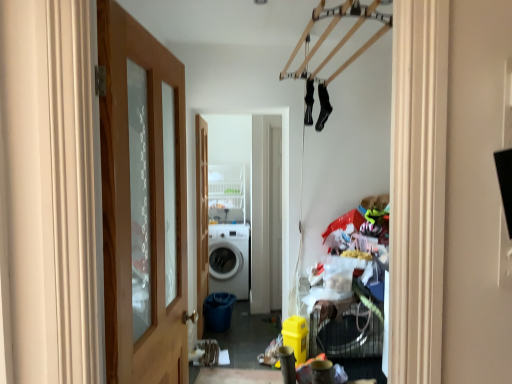
In the scene shown: How much space does black fabric socks at upper center, which ranks as the 1th clothing in right-to-left order, occupy vertically?

black fabric socks at upper center, which ranks as the 1th clothing in right-to-left order, is 14.52 inches in height.

This screenshot has width=512, height=384. Identify the location of black fabric socks at upper center, which ranks as the 1th clothing in right-to-left order. (323, 107).

The height and width of the screenshot is (384, 512). I want to click on white matte washing machine at center, so click(229, 259).

There is a wooden door at center, acting as the first door starting from the back. Where is `the 2nd clothing above it (from a real-world perspective)`? The width and height of the screenshot is (512, 384). the 2nd clothing above it (from a real-world perspective) is located at coordinates (309, 102).

Between black fabric socks at upper center, the second clothing positioned from the right, and wooden door at center, the second door in the right-to-left sequence, which one is positioned in front?

black fabric socks at upper center, the second clothing positioned from the right, is more forward.

Does black fabric socks at upper center, marked as the first clothing in a left-to-right arrangement, have a greater width compared to wooden door at center, which is the second door in front-to-back order?

In fact, black fabric socks at upper center, marked as the first clothing in a left-to-right arrangement, might be narrower than wooden door at center, which is the second door in front-to-back order.

Is point (307, 111) closer to camera compared to point (206, 154)?

Yes, it is.

Is point (176, 361) in front of point (197, 269)?

That is True.

Which is correct: wooden door at left, acting as the second door starting from the left, is inside wooden door at center, which is the second door in front-to-back order, or outside of it?

wooden door at left, acting as the second door starting from the left, lies outside wooden door at center, which is the second door in front-to-back order.

Which object is wider, wooden door at left, acting as the second door starting from the left, or wooden door at center, the second door in the right-to-left sequence?

wooden door at left, acting as the second door starting from the left.

Looking at this image, does wooden door at left, acting as the second door starting from the left, turn towards wooden door at center, the second door in the right-to-left sequence?

No, wooden door at left, acting as the second door starting from the left, is not aimed at wooden door at center, the second door in the right-to-left sequence.

Does point (323, 94) appear closer or farther from the camera than point (305, 96)?

Point (323, 94) is closer to the camera than point (305, 96).

Considering the relative sizes of black fabric socks at upper center, which ranks as the 1th clothing in right-to-left order, and black fabric socks at upper center, the second clothing positioned from the right, in the image provided, is black fabric socks at upper center, which ranks as the 1th clothing in right-to-left order, bigger than black fabric socks at upper center, the second clothing positioned from the right,?

Yes, black fabric socks at upper center, which ranks as the 1th clothing in right-to-left order, is bigger than black fabric socks at upper center, the second clothing positioned from the right.

Considering the relative sizes of black fabric socks at upper center, which is counted as the 2th clothing, starting from the left, and black fabric socks at upper center, marked as the first clothing in a left-to-right arrangement, in the image provided, is black fabric socks at upper center, which is counted as the 2th clothing, starting from the left, shorter than black fabric socks at upper center, marked as the first clothing in a left-to-right arrangement,?

Incorrect, the height of black fabric socks at upper center, which is counted as the 2th clothing, starting from the left, does not fall short of that of black fabric socks at upper center, marked as the first clothing in a left-to-right arrangement.

From a real-world perspective, is black fabric socks at upper center, which is counted as the 2th clothing, starting from the left, over black fabric socks at upper center, the second clothing positioned from the right?

No, from a real-world perspective, black fabric socks at upper center, which is counted as the 2th clothing, starting from the left, is not on top of black fabric socks at upper center, the second clothing positioned from the right.

Considering their positions, is wooden door at center, acting as the first door starting from the back, located in front of or behind black fabric socks at upper center, which is counted as the 2th clothing, starting from the left?

In the image, wooden door at center, acting as the first door starting from the back, appears behind black fabric socks at upper center, which is counted as the 2th clothing, starting from the left.

Between wooden door at center, acting as the first door starting from the back, and black fabric socks at upper center, which is counted as the 2th clothing, starting from the left, which one has smaller size?

black fabric socks at upper center, which is counted as the 2th clothing, starting from the left, is smaller.

Where is `door behind the black fabric socks at upper center, which ranks as the 1th clothing in right-to-left order`? Image resolution: width=512 pixels, height=384 pixels. door behind the black fabric socks at upper center, which ranks as the 1th clothing in right-to-left order is located at coordinates (202, 218).

Is wooden door at center, which is the second door in front-to-back order, turned away from black fabric socks at upper center, which is counted as the 2th clothing, starting from the left?

wooden door at center, which is the second door in front-to-back order, is not turned away from black fabric socks at upper center, which is counted as the 2th clothing, starting from the left.

Which of these two, black fabric socks at upper center, which is counted as the 2th clothing, starting from the left, or wooden door at center, which is the second door in front-to-back order, stands taller?

Standing taller between the two is wooden door at center, which is the second door in front-to-back order.

Choose the correct answer: Is black fabric socks at upper center, which is counted as the 2th clothing, starting from the left, inside wooden door at center, the second door in the right-to-left sequence, or outside it?

black fabric socks at upper center, which is counted as the 2th clothing, starting from the left, exists outside the volume of wooden door at center, the second door in the right-to-left sequence.

In the scene shown: Which object is positioned more to the left, black fabric socks at upper center, which is counted as the 2th clothing, starting from the left, or wooden door at center, acting as the first door starting from the back?

Positioned to the left is wooden door at center, acting as the first door starting from the back.

Considering the relative sizes of white matte washing machine at center and wooden door at left, which appears as the first door when viewed from the front, in the image provided, is white matte washing machine at center thinner than wooden door at left, which appears as the first door when viewed from the front,?

No.

From the image's perspective, is white matte washing machine at center located above or below wooden door at left, which is the 2th door from back to front?

white matte washing machine at center is below wooden door at left, which is the 2th door from back to front.

Is white matte washing machine at center in contact with wooden door at left, the first door when ordered from right to left?

No, white matte washing machine at center is not making contact with wooden door at left, the first door when ordered from right to left.

Is point (228, 270) positioned before point (104, 106)?

No.

Is point (197, 269) positioned after point (241, 245)?

No, (197, 269) is closer to viewer.

Looking at this image, can you confirm if wooden door at center, which is the second door in front-to-back order, is taller than white matte washing machine at center?

Indeed, wooden door at center, which is the second door in front-to-back order, has a greater height compared to white matte washing machine at center.

Is wooden door at center, which is the second door in front-to-back order, facing towards white matte washing machine at center?

No, wooden door at center, which is the second door in front-to-back order, is not aimed at white matte washing machine at center.

Would you say wooden door at center, arranged as the 1th door when viewed from the left, is to the left or to the right of white matte washing machine at center in the picture?

Clearly, wooden door at center, arranged as the 1th door when viewed from the left, is on the left of white matte washing machine at center in the image.

In order to click on the 2nd clothing in front of the wooden door at center, acting as the first door starting from the back, counting from the anchor's position in this screenshot , I will do `click(309, 102)`.

This screenshot has height=384, width=512. What are the coordinates of `door that is below the wooden door at left, the first door when ordered from right to left (from the image's perspective)` in the screenshot? It's located at (202, 218).

From the image, which object appears to be nearer to black fabric socks at upper center, which ranks as the 1th clothing in right-to-left order, black fabric socks at upper center, marked as the first clothing in a left-to-right arrangement, or white matte washing machine at center?

Based on the image, black fabric socks at upper center, marked as the first clothing in a left-to-right arrangement, appears to be nearer to black fabric socks at upper center, which ranks as the 1th clothing in right-to-left order.

From the picture: From the image, which object appears to be farther from black fabric socks at upper center, which is counted as the 2th clothing, starting from the left, white matte washing machine at center or black fabric socks at upper center, marked as the first clothing in a left-to-right arrangement?

white matte washing machine at center is further to black fabric socks at upper center, which is counted as the 2th clothing, starting from the left.

From the image, which object appears to be nearer to wooden door at center, acting as the first door starting from the back, white matte washing machine at center or wooden door at left, which is the 2th door from back to front?

The object closer to wooden door at center, acting as the first door starting from the back, is white matte washing machine at center.

When comparing their distances from black fabric socks at upper center, marked as the first clothing in a left-to-right arrangement, does wooden door at left, the first door when ordered from right to left, or white matte washing machine at center seem closer?

wooden door at left, the first door when ordered from right to left, lies closer to black fabric socks at upper center, marked as the first clothing in a left-to-right arrangement, than the other object.

Which object lies further to the anchor point black fabric socks at upper center, which is counted as the 2th clothing, starting from the left, white matte washing machine at center or wooden door at left, which is the 2th door from back to front?

Among the two, white matte washing machine at center is located further to black fabric socks at upper center, which is counted as the 2th clothing, starting from the left.

Which object lies nearer to the anchor point white matte washing machine at center, wooden door at center, the second door in the right-to-left sequence, or wooden door at left, acting as the second door starting from the left?

Based on the image, wooden door at center, the second door in the right-to-left sequence, appears to be nearer to white matte washing machine at center.

Estimate the real-world distances between objects in this image. Which object is closer to black fabric socks at upper center, which ranks as the 1th clothing in right-to-left order, wooden door at left, which appears as the first door when viewed from the front, or black fabric socks at upper center, marked as the first clothing in a left-to-right arrangement?

black fabric socks at upper center, marked as the first clothing in a left-to-right arrangement, lies closer to black fabric socks at upper center, which ranks as the 1th clothing in right-to-left order, than the other object.

Looking at the image, which one is located closer to wooden door at center, which is the second door in front-to-back order, black fabric socks at upper center, the second clothing positioned from the right, or white matte washing machine at center?

The object closer to wooden door at center, which is the second door in front-to-back order, is white matte washing machine at center.

Identify the location of clothing located between black fabric socks at upper center, the second clothing positioned from the right, and white matte washing machine at center in the depth direction. This screenshot has width=512, height=384. coord(323,107).

Where is `door positioned between black fabric socks at upper center, which ranks as the 1th clothing in right-to-left order, and white matte washing machine at center from near to far`? Image resolution: width=512 pixels, height=384 pixels. door positioned between black fabric socks at upper center, which ranks as the 1th clothing in right-to-left order, and white matte washing machine at center from near to far is located at coordinates (202, 218).

This screenshot has width=512, height=384. Identify the location of door positioned between wooden door at left, which is the 2th door from back to front, and white matte washing machine at center from near to far. (202, 218).

Image resolution: width=512 pixels, height=384 pixels. What are the coordinates of `door located between black fabric socks at upper center, marked as the first clothing in a left-to-right arrangement, and white matte washing machine at center in the depth direction` in the screenshot? It's located at (202, 218).